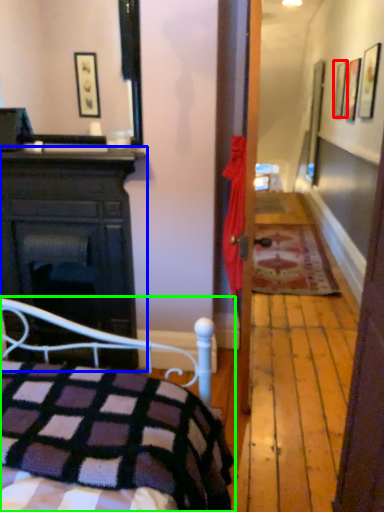
Question: Which is farther away from picture frame (highlighted by a red box)? cabinetry (highlighted by a blue box) or bed (highlighted by a green box)?

Choices:
 (A) cabinetry
 (B) bed

Answer: (B)